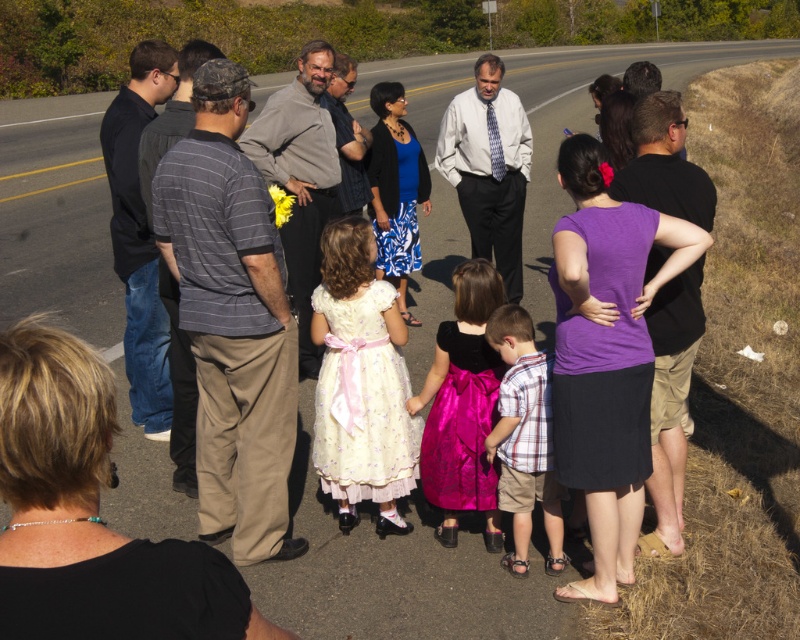
You are a photographer trying to capture a group photo of the people on the road. You notice two dresses at the center of the group. Which dress should the person wearing the white lace dress at center move to the right to align with the matte white dress at center?

The white lace dress at center should move to the right to align with the matte white dress at center since it is currently positioned to the left of it.

You are a photographer standing at the edge of the road. You want to take a photo of the striped cotton shirt at center so that it appears clearly in the foreground. Given that your camera has a minimum focusing distance of 4 meters, will you need to move closer or farther away to ensure the shirt is in focus?

The striped cotton shirt at center is currently 3.93 meters away from the camera. Since the minimum focusing distance is 4 meters, you need to move slightly farther away to reach the required distance for clear focus.